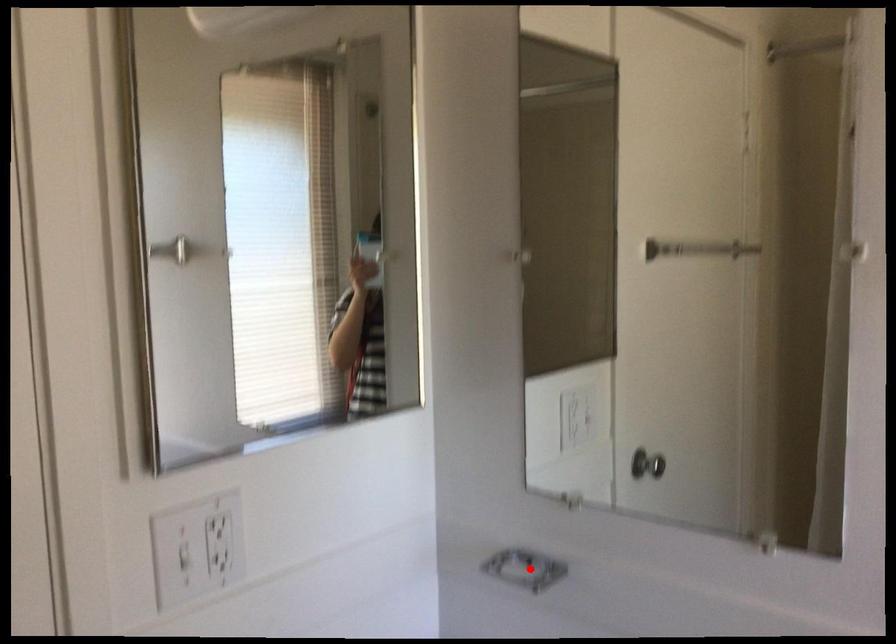
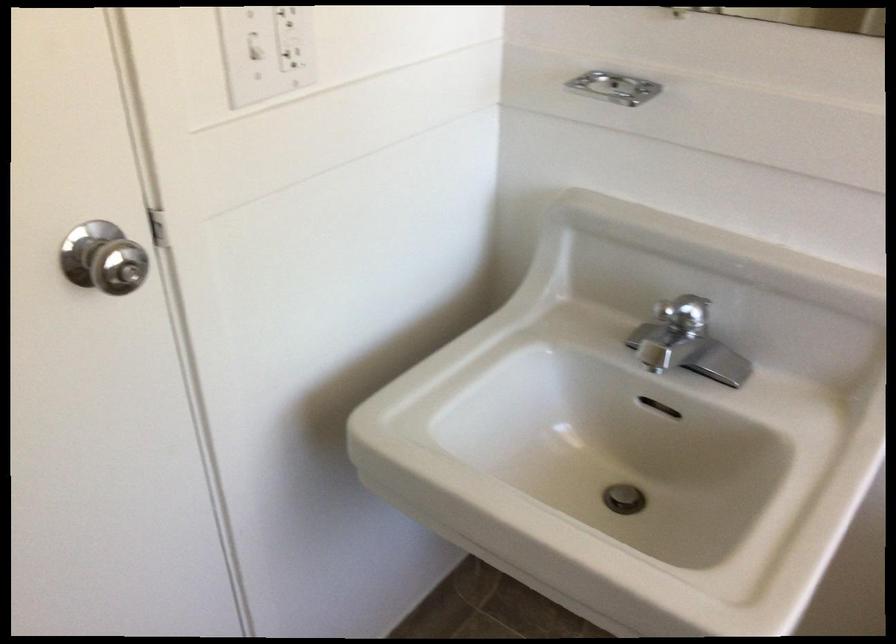
In the second image, find the point that corresponds to the highlighted location in the first image.

(615, 87)